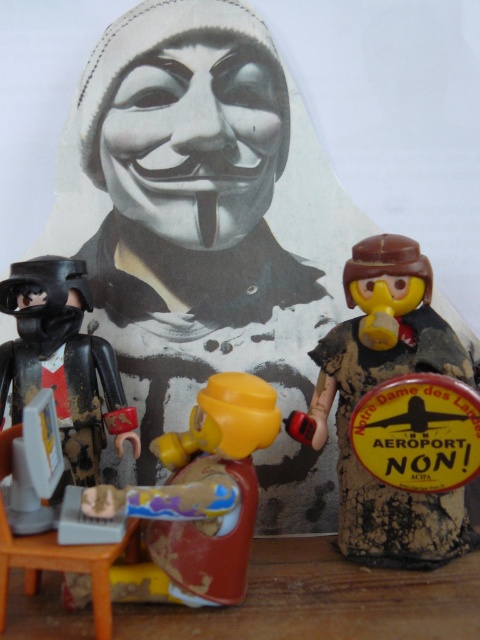
Locate an element on the screen. This screenshot has width=480, height=640. wooden figure at right is located at coordinates (371, 388).

Is wooden figure at right above matte yellow figure at center?

Yes.

Does point (376, 310) come closer to viewer compared to point (162, 497)?

That is False.

Find the location of a particular element. wooden figure at right is located at coordinates (371, 388).

Who is more distant from viewer, (192, 410) or (35, 337)?

Point (35, 337)

Is matte yellow figure at center shorter than black matte armor at left?

Yes, matte yellow figure at center is shorter than black matte armor at left.

The width and height of the screenshot is (480, 640). Describe the element at coordinates (200, 499) in the screenshot. I see `matte yellow figure at center` at that location.

At what (x,y) coordinates should I click in order to perform the action: click on matte yellow figure at center. Please return your answer as a coordinate pair (x, y). Looking at the image, I should click on (200, 499).

Which is behind, point (351, 552) or point (54, 269)?

Positioned behind is point (54, 269).

Between point (415, 513) and point (87, 420), which one is positioned in front?

Point (415, 513) is in front.

This screenshot has width=480, height=640. In order to click on wooden figure at right in this screenshot , I will do `click(371, 388)`.